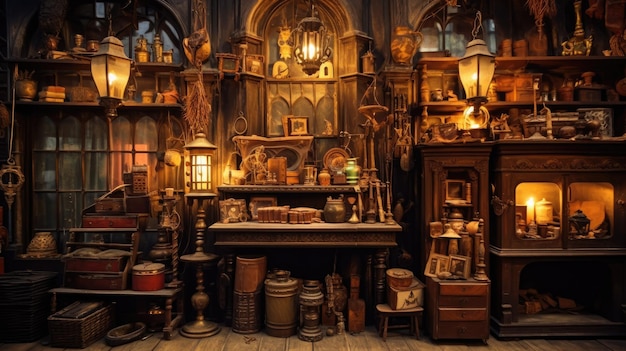
Locate an element on the screen. windows is located at coordinates (71, 149), (141, 134), (307, 105), (454, 39).